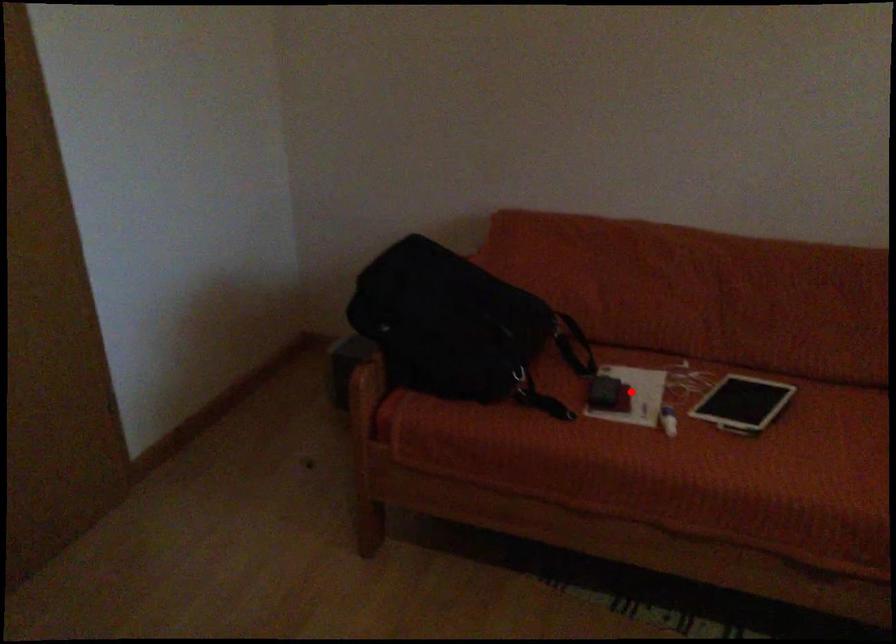
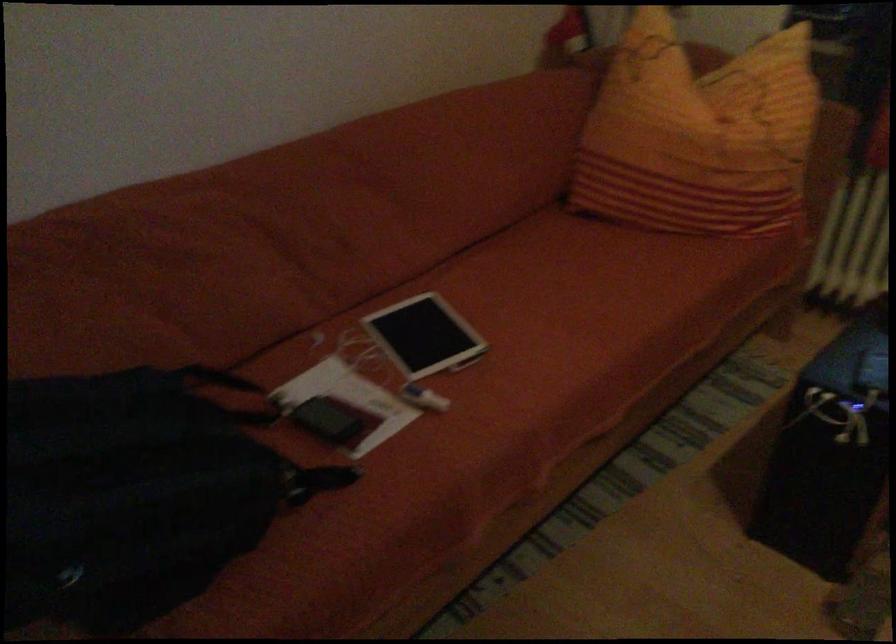
Find the pixel in the second image that matches the highlighted location in the first image.

(350, 401)